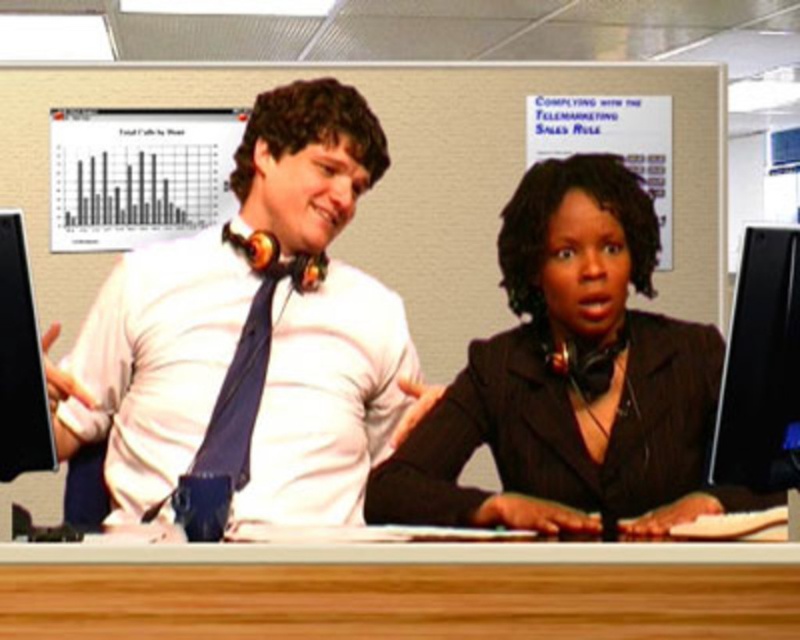
Question: Which object appears closest to the camera in this image?

Choices:
 (A) wooden desk at lower center
 (B) black glossy monitor at right
 (C) black plastic monitor at left

Answer: (A)

Question: Where is black matte suit at center located in relation to wooden desk at lower center in the image?

Choices:
 (A) above
 (B) below

Answer: (A)

Question: Is black glossy monitor at right to the right of matte blue tie at center from the viewer's perspective?

Choices:
 (A) yes
 (B) no

Answer: (A)

Question: Which of the following is the farthest from the observer?

Choices:
 (A) black matte suit at center
 (B) black glossy monitor at right
 (C) black plastic monitor at left
 (D) matte blue tie at center

Answer: (A)

Question: Is the position of black matte suit at center more distant than that of wooden desk at lower center?

Choices:
 (A) no
 (B) yes

Answer: (B)

Question: Which point is closer to the camera?

Choices:
 (A) (206, 454)
 (B) (296, 561)
 (C) (333, 406)

Answer: (B)